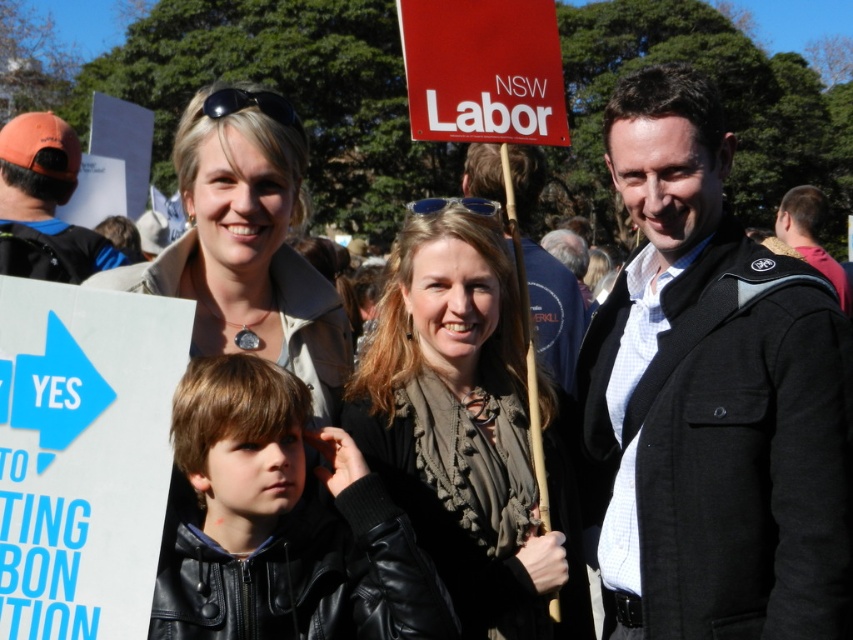
You are organizing a charity event and need to place a small donation box between the orange fabric cap at left and the matte black jacket at right. Given their sizes, which object should the donation box be closer to?

The orange fabric cap at left has a smaller size compared to matte black jacket at right, so the donation box should be placed closer to the orange fabric cap at left to ensure proper spacing between the two objects.